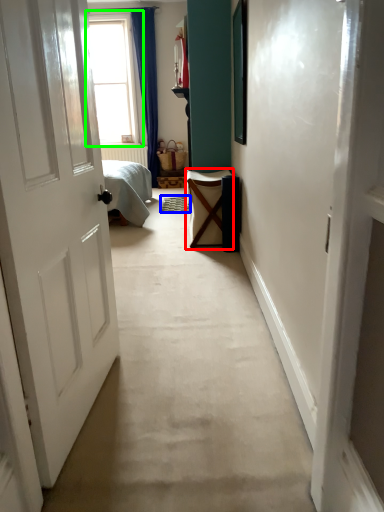
Question: Which object is the farthest from furniture (highlighted by a red box)? Choose among these: doormat (highlighted by a blue box) or window (highlighted by a green box).

Choices:
 (A) doormat
 (B) window

Answer: (B)